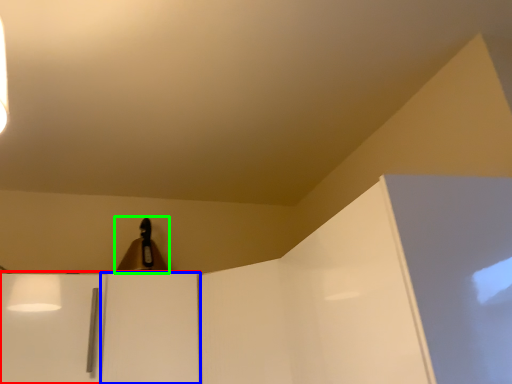
Question: Estimate the real-world distances between objects in this image. Which object is farther from cabinetry (highlighted by a red box), door (highlighted by a blue box) or lamp (highlighted by a green box)?

Choices:
 (A) door
 (B) lamp

Answer: (B)